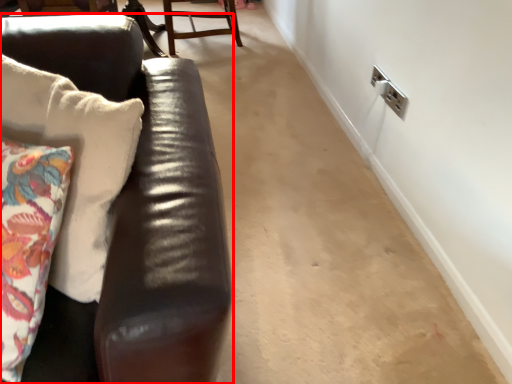
Question: From the image's perspective, considering the relative positions of studio couch (annotated by the red box) and chair in the image provided, where is studio couch (annotated by the red box) located with respect to the staircase?

Choices:
 (A) below
 (B) above

Answer: (A)